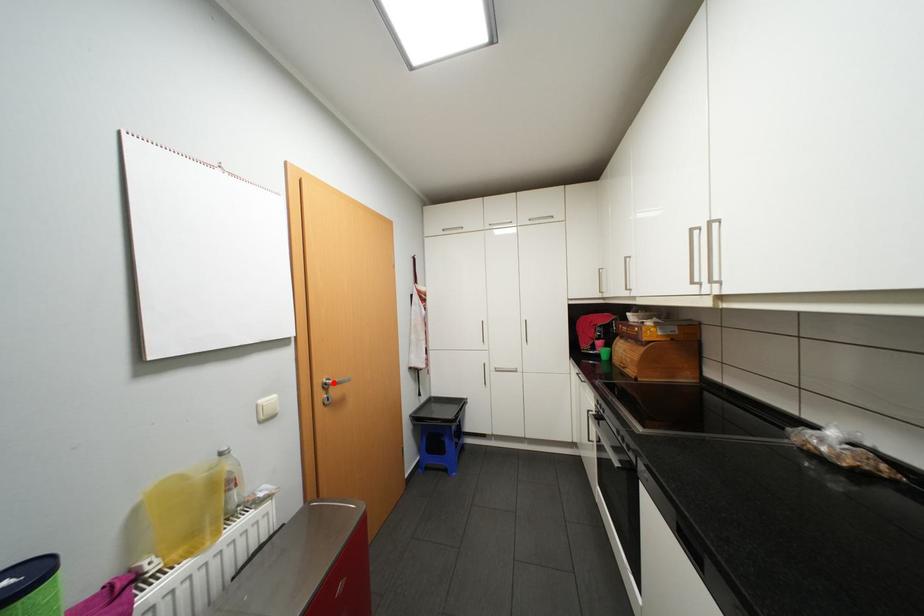
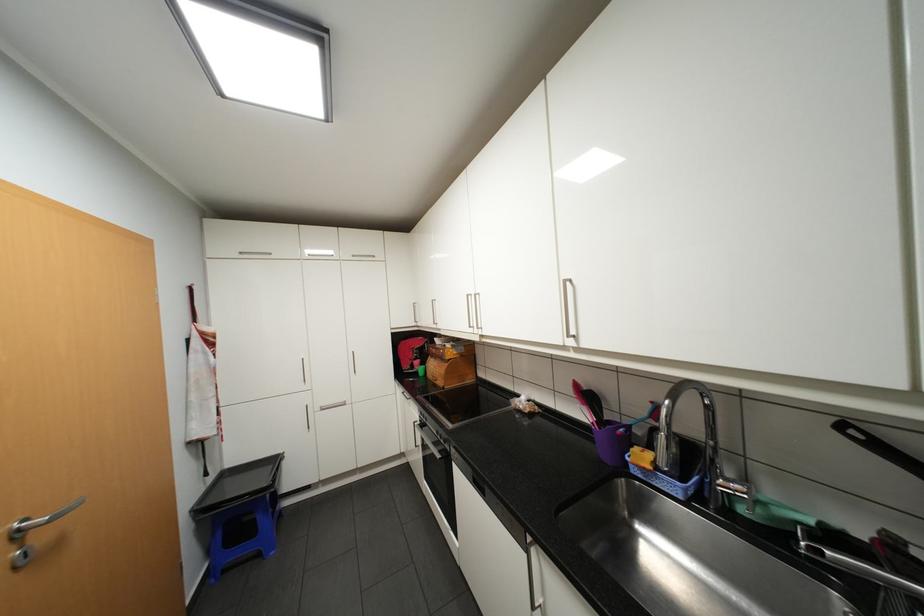
Find the pixel in the second image that matches the highlighted location in the first image.

(27, 530)